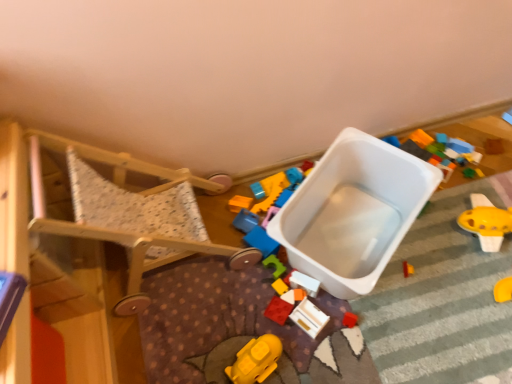
The image size is (512, 384). Find the location of `vacant space behind rubberized red block at center, which is counted as the second toy, starting from the left`. vacant space behind rubberized red block at center, which is counted as the second toy, starting from the left is located at coordinates pyautogui.click(x=265, y=273).